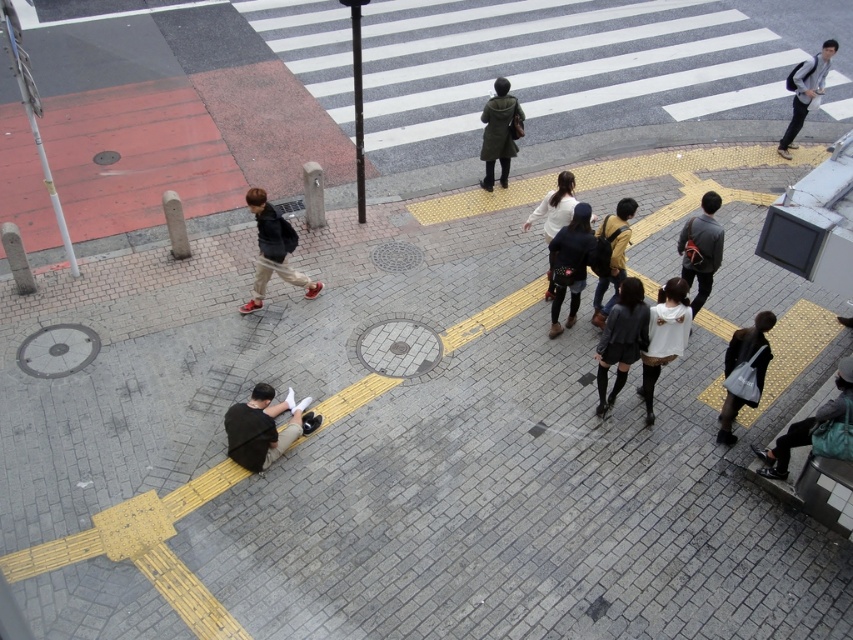
Does matte black bag at lower right appear on the left side of white matte jacket at center?

No, matte black bag at lower right is not to the left of white matte jacket at center.

Is matte black bag at lower right behind white matte jacket at center?

No, matte black bag at lower right is closer to the viewer.

Which is behind, point (758, 333) or point (556, 196)?

The point (556, 196) is more distant.

The width and height of the screenshot is (853, 640). Identify the location of matte black bag at lower right. (750, 346).

Is dark gray jacket at right wider than white matte jacket at center?

Yes.

Does dark gray jacket at right have a greater height compared to white matte jacket at center?

Indeed, dark gray jacket at right has a greater height compared to white matte jacket at center.

The width and height of the screenshot is (853, 640). Identify the location of dark gray jacket at right. (701, 248).

Between dark gray pants at lower left and dark gray jacket at right, which one has more height?

dark gray jacket at right is taller.

Does point (242, 454) come in front of point (705, 228)?

That is True.

Measure the distance between dark gray pants at lower left and camera.

dark gray pants at lower left and camera are 7.34 meters apart from each other.

In order to click on dark gray pants at lower left in this screenshot , I will do click(x=265, y=428).